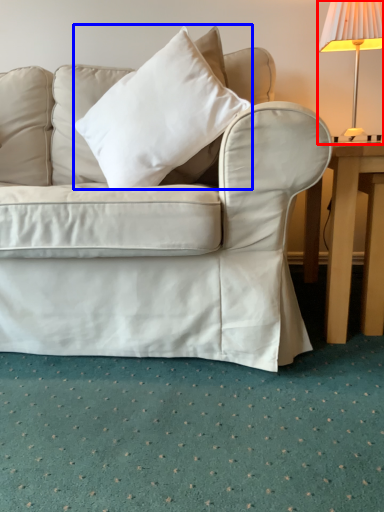
Question: Among these objects, which one is nearest to the camera, lamp (highlighted by a red box) or pillow (highlighted by a blue box)?

Choices:
 (A) lamp
 (B) pillow

Answer: (B)